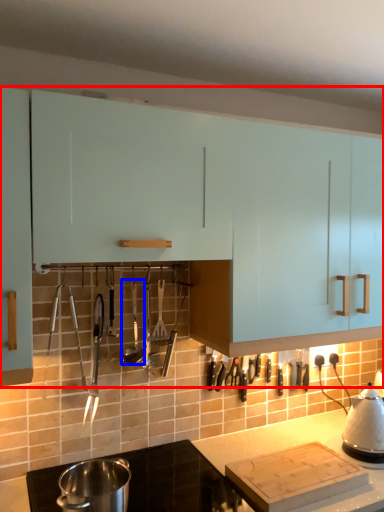
Question: Among these objects, which one is nearest to the camera, cabinetry (highlighted by a red box) or silverware (highlighted by a blue box)?

Choices:
 (A) cabinetry
 (B) silverware

Answer: (A)